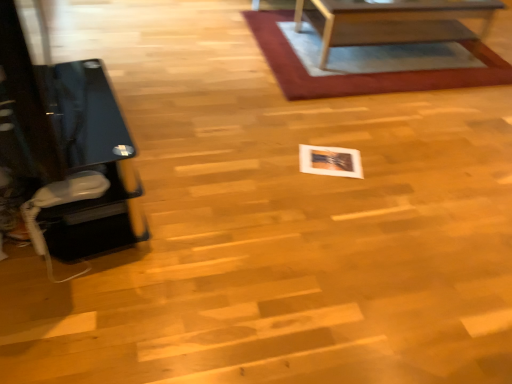
What is the approximate width of white glossy photo frame at center?

white glossy photo frame at center is 11.79 inches wide.

The height and width of the screenshot is (384, 512). What do you see at coordinates (67, 151) in the screenshot?
I see `black glass table at left` at bounding box center [67, 151].

The width and height of the screenshot is (512, 384). I want to click on white glossy photo frame at center, so click(x=330, y=161).

Is black glass table at left spatially inside rug with woven texture at upper center, or outside of it?

black glass table at left is outside rug with woven texture at upper center.

How many degrees apart are the facing directions of black glass table at left and rug with woven texture at upper center?

99.6 degrees.

From the image's perspective, would you say black glass table at left is positioned over rug with woven texture at upper center?

Incorrect, from the image's perspective, black glass table at left is lower than rug with woven texture at upper center.

Is black glass table at left in front of or behind rug with woven texture at upper center in the image?

Clearly, black glass table at left is in front of rug with woven texture at upper center.

Based on the photo, is wooden table at upper center not close to white glossy photo frame at center?

Yes, wooden table at upper center is far from white glossy photo frame at center.

How different are the orientations of wooden table at upper center and white glossy photo frame at center in degrees?

The angular difference between wooden table at upper center and white glossy photo frame at center is 112 degrees.

Could you tell me if wooden table at upper center is turned towards white glossy photo frame at center?

Yes.

From the image's perspective, between wooden table at upper center and white glossy photo frame at center, which one is located above?

wooden table at upper center, from the image's perspective.

Which of these two, wooden table at upper center or black glass table at left, stands shorter?

wooden table at upper center is shorter.

Which is closer, (452,17) or (70,102)?

Point (70,102)

What's the angular difference between wooden table at upper center and black glass table at left's facing directions?

99.2 degrees.

Which object is positioned more to the left, wooden table at upper center or black glass table at left?

From the viewer's perspective, black glass table at left appears more on the left side.

Can you see rug with woven texture at upper center touching black glass table at left?

No, rug with woven texture at upper center is not with black glass table at left.

Based on their sizes in the image, would you say rug with woven texture at upper center is bigger or smaller than black glass table at left?

Clearly, rug with woven texture at upper center is larger in size than black glass table at left.

Is rug with woven texture at upper center to the left or to the right of black glass table at left in the image?

Clearly, rug with woven texture at upper center is on the right of black glass table at left in the image.

From the picture: Considering the sizes of rug with woven texture at upper center and black glass table at left in the image, is rug with woven texture at upper center wider or thinner than black glass table at left?

In the image, rug with woven texture at upper center appears to be wider than black glass table at left.

Is the position of wooden table at upper center less distant than that of rug with woven texture at upper center?

Yes.

From a real-world perspective, between wooden table at upper center and rug with woven texture at upper center, who is vertically lower?

rug with woven texture at upper center, from a real-world perspective.

From the image's perspective, which is above, wooden table at upper center or rug with woven texture at upper center?

wooden table at upper center, from the image's perspective.

Is wooden table at upper center taller than rug with woven texture at upper center?

Correct, wooden table at upper center is much taller as rug with woven texture at upper center.

Is white glossy photo frame at center to the right of black glass table at left from the viewer's perspective?

Yes.

Is white glossy photo frame at center inside the boundaries of black glass table at left, or outside?

white glossy photo frame at center exists outside the volume of black glass table at left.

Considering the positions of objects white glossy photo frame at center and black glass table at left in the image provided, who is in front, white glossy photo frame at center or black glass table at left?

black glass table at left is in front.

How many degrees apart are the facing directions of white glossy photo frame at center and black glass table at left?

148 degrees.

Considering the relative sizes of white glossy photo frame at center and rug with woven texture at upper center in the image provided, is white glossy photo frame at center bigger than rug with woven texture at upper center?

Actually, white glossy photo frame at center might be smaller than rug with woven texture at upper center.

From the picture: In terms of width, does white glossy photo frame at center look wider or thinner when compared to rug with woven texture at upper center?

Considering their sizes, white glossy photo frame at center looks slimmer than rug with woven texture at upper center.

Which is more distant, (339, 154) or (274, 11)?

Point (274, 11)

Locate an element on the screen. square on the left of rug with woven texture at upper center is located at coordinates (330, 161).

In the image, there is a black glass table at left. Where is `mat below it (from a real-world perspective)`? mat below it (from a real-world perspective) is located at coordinates click(x=364, y=74).

Locate an element on the screen. The width and height of the screenshot is (512, 384). square lying below the wooden table at upper center (from the image's perspective) is located at coordinates (330, 161).

Looking at the image, which one is located further to rug with woven texture at upper center, wooden table at upper center or black glass table at left?

black glass table at left is positioned further to the anchor rug with woven texture at upper center.

Considering their positions, is black glass table at left positioned closer to rug with woven texture at upper center than white glossy photo frame at center?

white glossy photo frame at center.

Estimate the real-world distances between objects in this image. Which object is further from black glass table at left, rug with woven texture at upper center or white glossy photo frame at center?

The object further to black glass table at left is rug with woven texture at upper center.

Based on their spatial positions, is white glossy photo frame at center or black glass table at left closer to rug with woven texture at upper center?

Based on the image, white glossy photo frame at center appears to be nearer to rug with woven texture at upper center.

When comparing their distances from white glossy photo frame at center, does wooden table at upper center or rug with woven texture at upper center seem further?

Based on the image, wooden table at upper center appears to be further to white glossy photo frame at center.

From the image, which object appears to be nearer to white glossy photo frame at center, wooden table at upper center or black glass table at left?

Among the two, black glass table at left is located nearer to white glossy photo frame at center.

Looking at the image, which one is located further to wooden table at upper center, rug with woven texture at upper center or black glass table at left?

black glass table at left is further to wooden table at upper center.

Which object lies further to the anchor point black glass table at left, white glossy photo frame at center or rug with woven texture at upper center?

rug with woven texture at upper center is further to black glass table at left.

Locate an element on the screen. square situated between black glass table at left and rug with woven texture at upper center from left to right is located at coordinates (330, 161).

This screenshot has height=384, width=512. Find the location of `mat between black glass table at left and wooden table at upper center in the horizontal direction`. mat between black glass table at left and wooden table at upper center in the horizontal direction is located at coordinates (364, 74).

In order to click on mat that lies between wooden table at upper center and white glossy photo frame at center from top to bottom in this screenshot , I will do [x=364, y=74].

At what (x,y) coordinates should I click in order to perform the action: click on square between black glass table at left and wooden table at upper center from left to right. Please return your answer as a coordinate pair (x, y). Image resolution: width=512 pixels, height=384 pixels. Looking at the image, I should click on click(x=330, y=161).